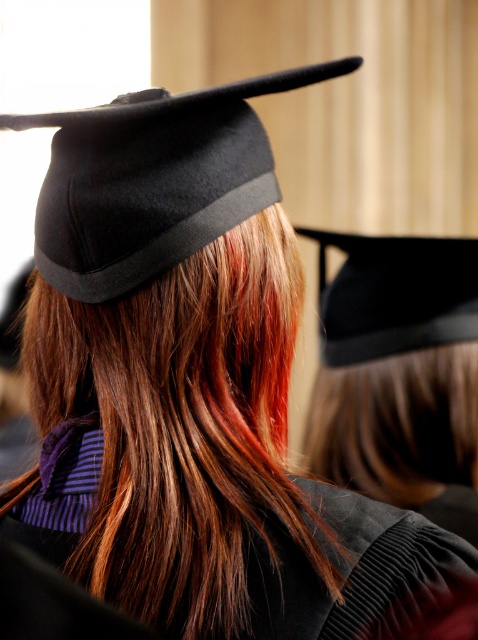
Question: Does brown silky hair at center appear over velvet black robe at center?

Choices:
 (A) yes
 (B) no

Answer: (A)

Question: Is black felt graduation cap at upper center smaller than velvet black robe at center?

Choices:
 (A) no
 (B) yes

Answer: (B)

Question: Which point appears closest to the camera in this image?

Choices:
 (A) (264, 248)
 (B) (183, 198)
 (C) (424, 241)
 (D) (333, 563)

Answer: (D)

Question: Which of the following is the farthest from the observer?

Choices:
 (A) black felt graduation cap at upper center
 (B) velvet black robe at center
 (C) brown silky hair at center

Answer: (A)

Question: Which object is the farthest from the black matte graduation cap at center?

Choices:
 (A) black felt graduation cap at upper center
 (B) brown silky hair at center

Answer: (A)

Question: Is velvet black robe at center positioned before black matte graduation cap at center?

Choices:
 (A) no
 (B) yes

Answer: (B)